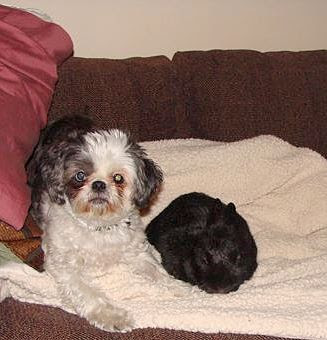
Identify the location of blanket. (294, 262).